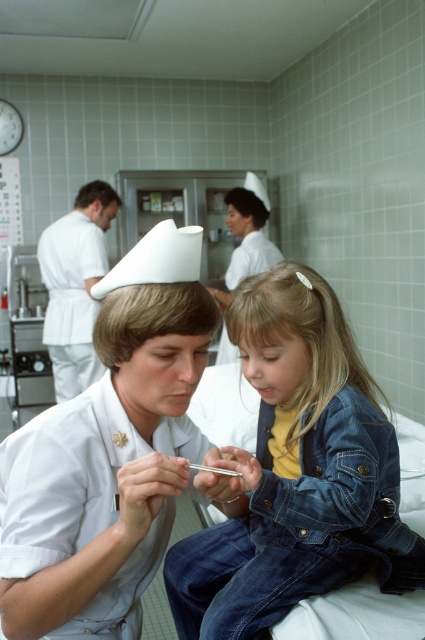
You are a patient in this medical setting and need to locate your belongings. You remember seeing a denim jacket at lower right and a white uniform at center. Which item is closer to you from your current position?

The denim jacket at lower right is in front of the white uniform at center, so it is closer to you.

In the scene shown: You are a photographer taking a picture of the nurse and the girl in the medical setting. You notice two points marked in the scene. Which point, point 1 at coordinates (x=27, y=628) or point 2 at (x=251, y=349), is closer to your camera lens?

Point 1 at coordinates (x=27, y=628) is closer to the camera lens than point 2 at (x=251, y=349).

Consider the image. You are a patient entering the clinic and see the denim jacket at lower right and the white uniform at center. Which clothing item is located to the left of the other?

The denim jacket at lower right is positioned on the left side of white uniform at center.